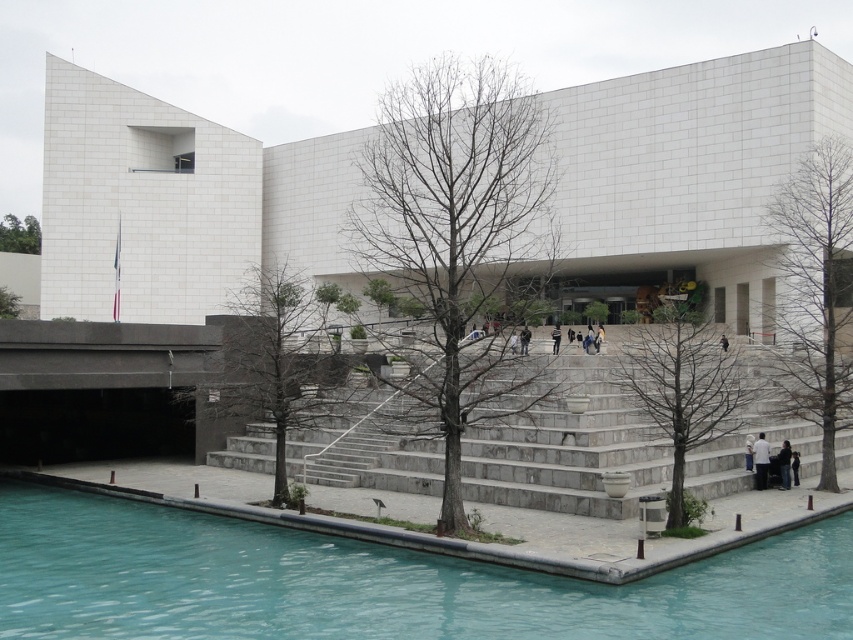
Looking at this image, does clear blue water at bottom left lie behind gray stone stairs at center?

A: No, clear blue water at bottom left is in front of gray stone stairs at center.

Based on the photo, is clear blue water at bottom left wider than gray stone stairs at center?

Incorrect, clear blue water at bottom left's width does not surpass gray stone stairs at center's.

Where is `clear blue water at bottom left`? clear blue water at bottom left is located at coordinates (374, 582).

Identify the location of clear blue water at bottom left. The width and height of the screenshot is (853, 640). (374, 582).

Between point (498, 102) and point (280, 384), which one is positioned in front?

Positioned in front is point (498, 102).

How much distance is there between bare branches at center and green leafy tree at center?

The distance of bare branches at center from green leafy tree at center is 18.17 meters.

Which is in front, point (454, 531) or point (305, 324)?

Positioned in front is point (454, 531).

You are a GUI agent. You are given a task and a screenshot of the screen. Output one action in this format:
    pyautogui.click(x=<x>, y=<y>)
    Task: Click on the bare branches at center
    The width and height of the screenshot is (853, 640).
    Given the screenshot: What is the action you would take?
    click(457, 227)

Is bare branches at center to the left of brown bark tree at right from the viewer's perspective?

Correct, you'll find bare branches at center to the left of brown bark tree at right.

Does bare branches at center appear on the right side of brown bark tree at right?

No, bare branches at center is not to the right of brown bark tree at right.

At what (x,y) coordinates should I click in order to perform the action: click on bare branches at center. Please return your answer as a coordinate pair (x, y). Looking at the image, I should click on coord(457,227).